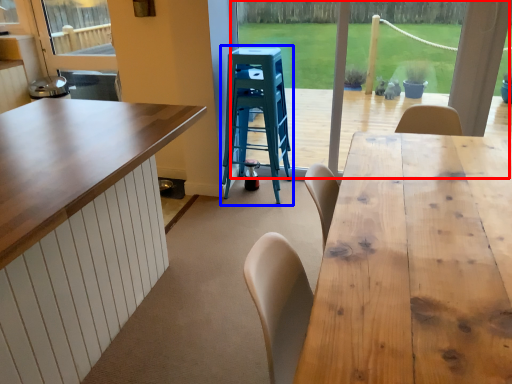
Question: Which object is further to the camera taking this photo, window frame (highlighted by a red box) or step stool (highlighted by a blue box)?

Choices:
 (A) window frame
 (B) step stool

Answer: (B)